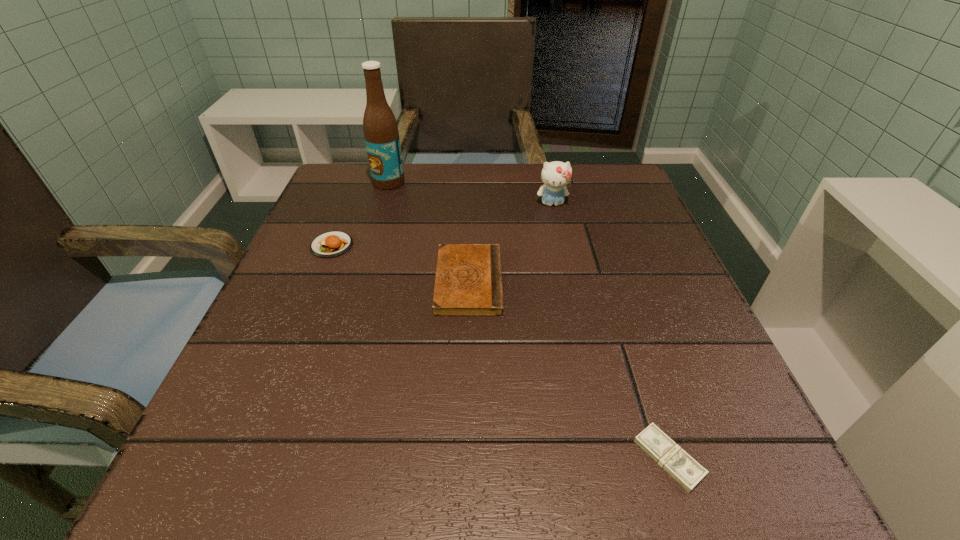
Identify the location of free location located on the front-facing side of the second tallest object. (568, 275).

Find the location of `vacant space located 0.070m on the back of the patty (food)`. vacant space located 0.070m on the back of the patty (food) is located at coordinates (345, 214).

What are the coordinates of `free space located on the spine side of the diary` in the screenshot? It's located at (672, 282).

The image size is (960, 540). In order to click on free region located 0.370m on the left of the money in this screenshot , I will do `click(355, 458)`.

At what (x,y) coordinates should I click in order to perform the action: click on beer bottle that is positioned at the far edge. Please return your answer as a coordinate pair (x, y). This screenshot has height=540, width=960. Looking at the image, I should click on (380, 128).

Image resolution: width=960 pixels, height=540 pixels. Identify the location of kitten present at the far edge. (555, 175).

Where is `object that is at the near edge`? object that is at the near edge is located at coordinates (663, 450).

The width and height of the screenshot is (960, 540). What are the coordinates of `beer bottle that is at the left edge` in the screenshot? It's located at (380, 128).

I want to click on patty (food) located in the left edge section of the desktop, so click(x=331, y=244).

Locate an element on the screen. The height and width of the screenshot is (540, 960). object that is positioned at the right edge is located at coordinates (663, 450).